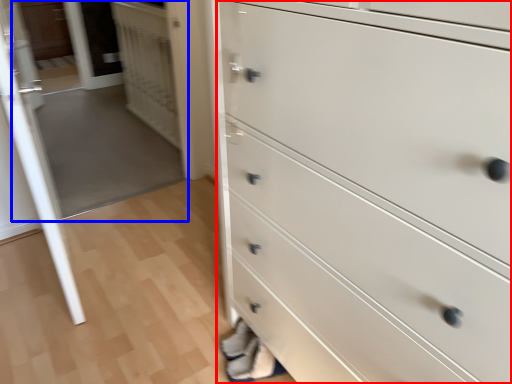
Question: Which point is closer to the camera, chest of drawers (highlighted by a red box) or glass door (highlighted by a blue box)?

Choices:
 (A) chest of drawers
 (B) glass door

Answer: (A)